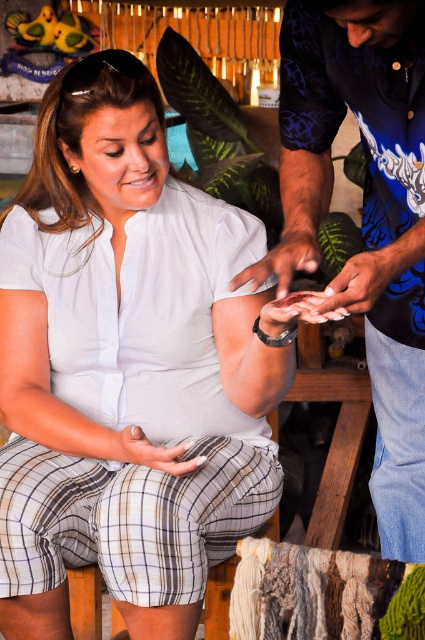
Question: Can you confirm if white matte shirt at center is wider than blue printed shirt at center?

Choices:
 (A) no
 (B) yes

Answer: (B)

Question: Is white matte shirt at center wider than blue printed shirt at center?

Choices:
 (A) no
 (B) yes

Answer: (B)

Question: Among these objects, which one is nearest to the camera?

Choices:
 (A) blue printed shirt at center
 (B) white matte shirt at center

Answer: (A)

Question: Which of the following is the farthest from the observer?

Choices:
 (A) white matte shirt at center
 (B) blue printed shirt at center

Answer: (A)

Question: Is white matte shirt at center bigger than blue printed shirt at center?

Choices:
 (A) yes
 (B) no

Answer: (A)

Question: Which point appears farthest from the camera in this image?

Choices:
 (A) (384, 205)
 (B) (223, 365)

Answer: (B)